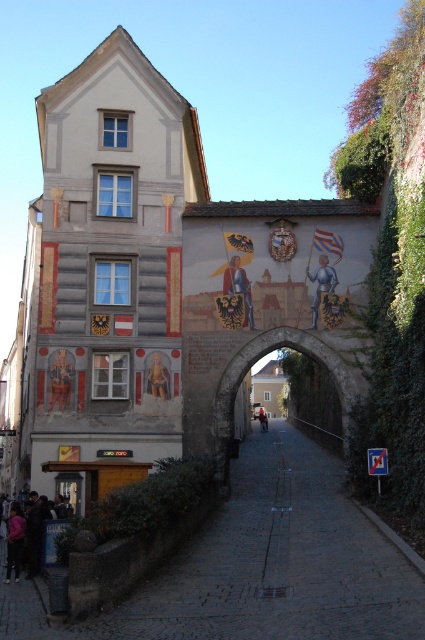
In order to click on stone archway at center in this screenshot , I will do `click(263, 355)`.

Locate an element on the screen. This screenshot has width=425, height=640. stone archway at center is located at coordinates (263, 355).

Looking at this image, is cobblestone alley at center thinner than matte gold painting at left?

Incorrect, cobblestone alley at center's width is not less than matte gold painting at left's.

Identify the location of cobblestone alley at center. This screenshot has height=640, width=425. (260, 564).

Find the location of `cobblestone alley at center`. cobblestone alley at center is located at coordinates (260, 564).

Is stone archway at center to the right of dark blue jeans at lower left from the viewer's perspective?

Yes, stone archway at center is to the right of dark blue jeans at lower left.

Based on the photo, who is positioned more to the left, stone archway at center or dark blue jeans at lower left?

From the viewer's perspective, dark blue jeans at lower left appears more on the left side.

Which is behind, point (342, 426) or point (19, 541)?

The point (342, 426) is more distant.

Locate an element on the screen. stone archway at center is located at coordinates (263, 355).